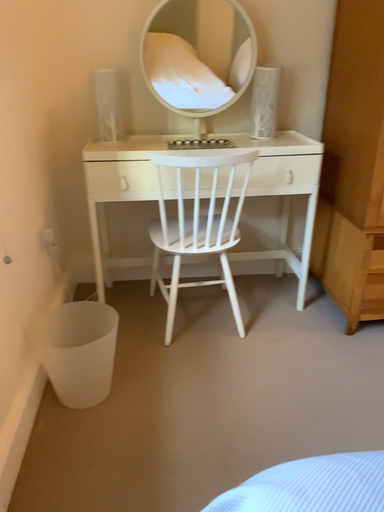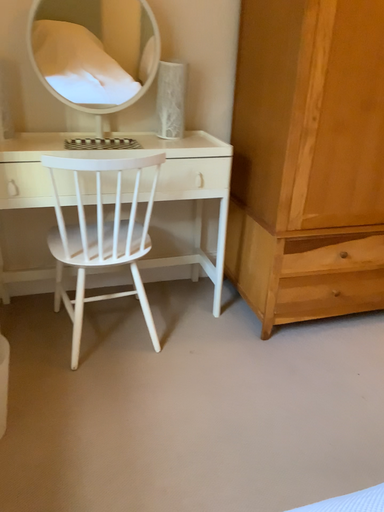
Question: Which way did the camera rotate in the video?

Choices:
 (A) rotated right
 (B) rotated left

Answer: (A)